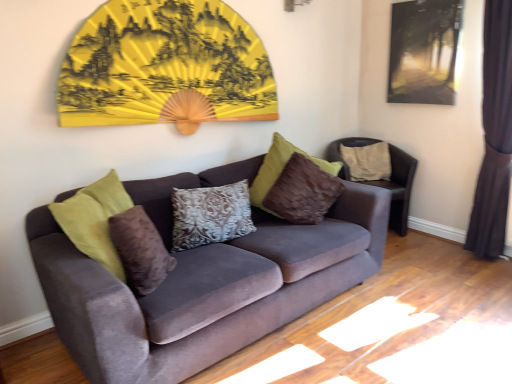
What are the coordinates of `blank area beneath dark brown velvet curtain at right (from a real-world perspective)` in the screenshot? It's located at tap(477, 254).